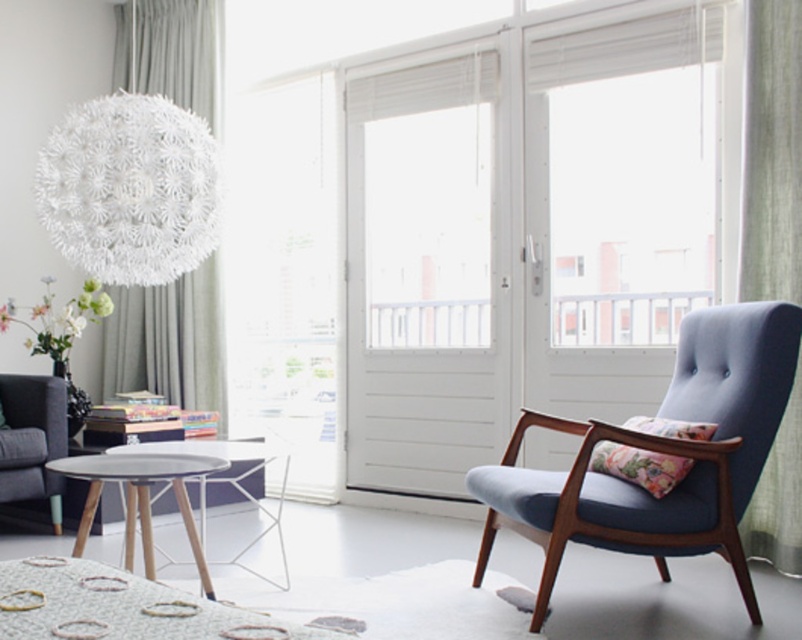
Question: From the image, what is the correct spatial relationship of wooden/metallic side table at lower left in relation to matte gray table at center?

Choices:
 (A) right
 (B) left

Answer: (B)

Question: Which point is farther from the camera taking this photo?

Choices:
 (A) (683, 291)
 (B) (442, 88)
 (C) (148, 572)

Answer: (B)

Question: Among these points, which one is farthest from the camera?

Choices:
 (A) (448, 381)
 (B) (51, 456)

Answer: (A)

Question: Is blue fabric armchair at right below floral fabric pillow at lower right?

Choices:
 (A) yes
 (B) no

Answer: (A)

Question: Can you confirm if matte gray table at center is wider than floral fabric cushion at right?

Choices:
 (A) yes
 (B) no

Answer: (A)

Question: Considering the real-world distances, which object is closest to the blue fabric armchair at right?

Choices:
 (A) matte gray table at center
 (B) wooden/metallic side table at lower left
 (C) floral fabric cushion at right

Answer: (C)